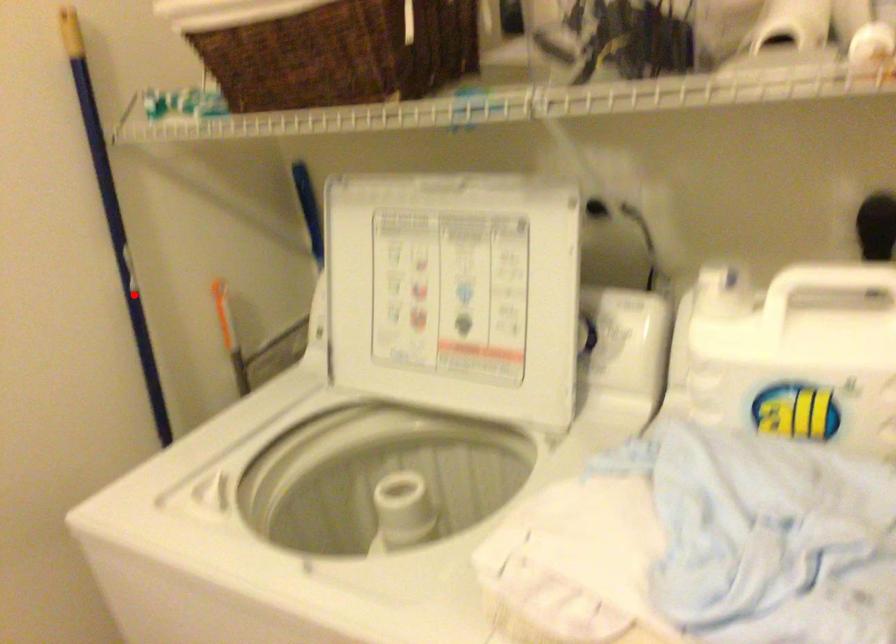
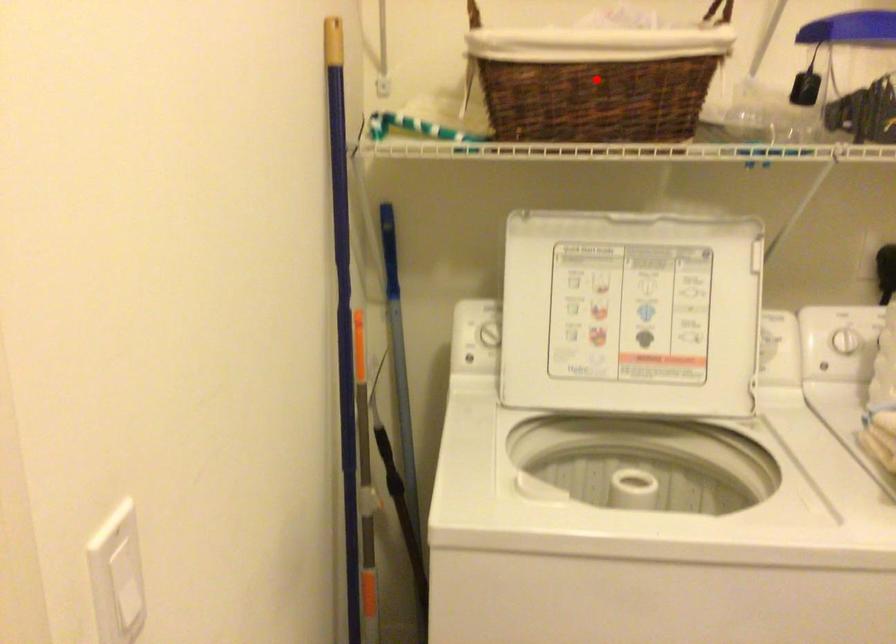
I am providing you with two images of the same scene from different viewpoints. A red point is marked on the first image and another point is marked on the second image. Do the highlighted points in image1 and image2 indicate the same real-world spot?

No